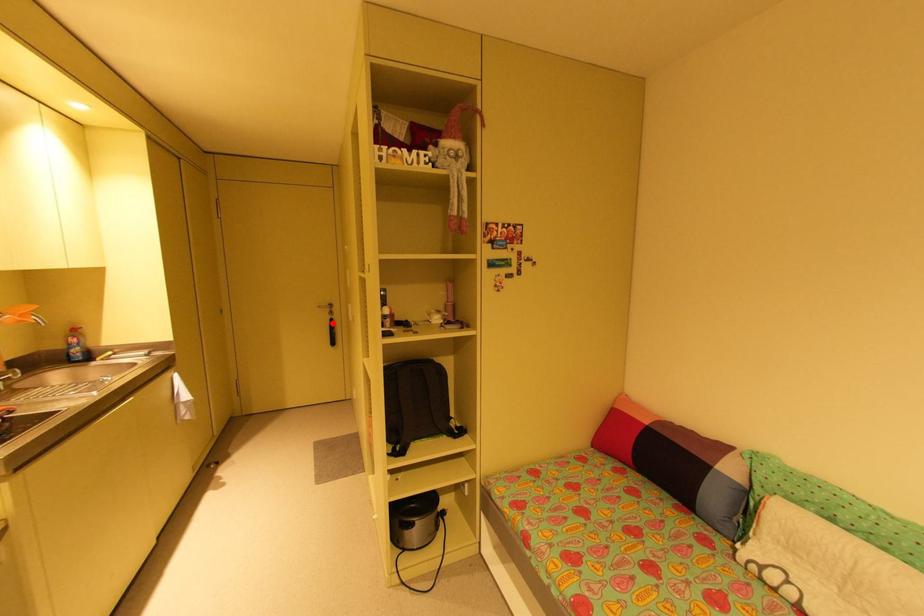
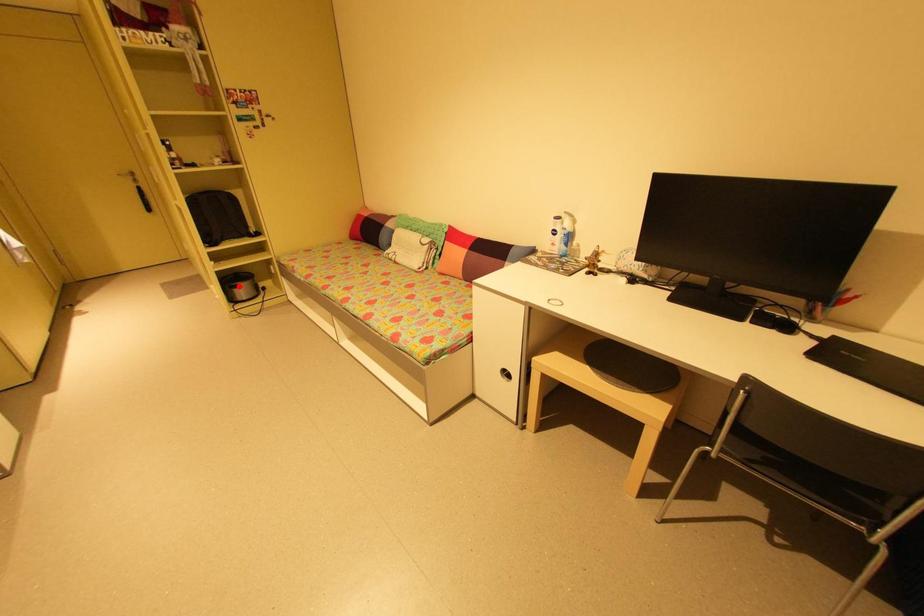
I am providing you with two images of the same scene from different viewpoints. A red point is marked on the first image and another point is marked on the second image. Is the red point in image1 aligned with the point shown in image2?

No